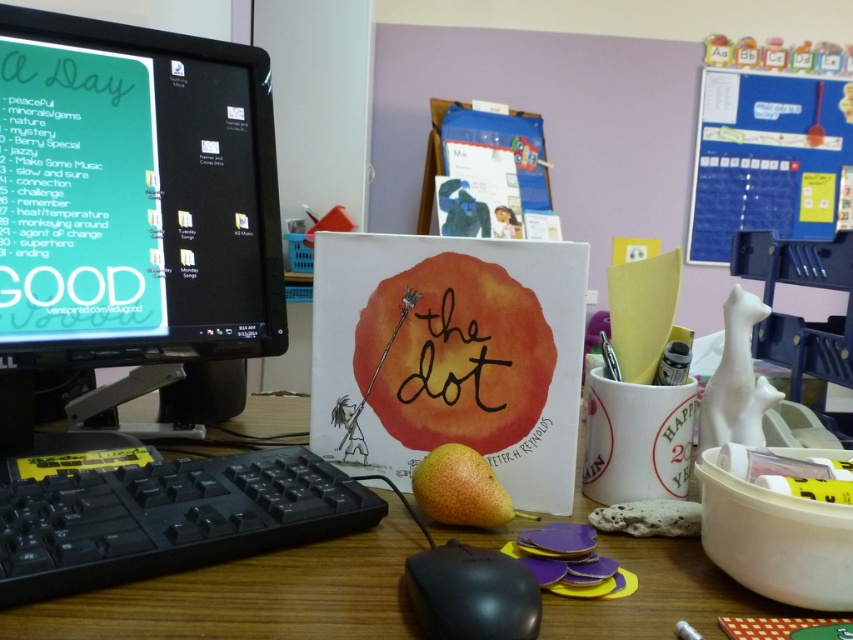
Question: Does wooden table at center appear over blue fabric calendar at upper right?

Choices:
 (A) no
 (B) yes

Answer: (A)

Question: Is blue fabric calendar at upper right thinner than yellow matte pear at center?

Choices:
 (A) no
 (B) yes

Answer: (A)

Question: Among these objects, which one is nearest to the camera?

Choices:
 (A) wooden table at center
 (B) black plastic keyboard at lower left

Answer: (A)

Question: Can you confirm if black plastic keyboard at lower left is bigger than blue fabric calendar at upper right?

Choices:
 (A) no
 (B) yes

Answer: (A)

Question: Which of these objects is positioned farthest from the black plastic mouse at center?

Choices:
 (A) wooden table at center
 (B) blue fabric calendar at upper right

Answer: (B)

Question: Estimate the real-world distances between objects in this image. Which object is farther from the wooden table at center?

Choices:
 (A) yellow matte pear at center
 (B) black plastic keyboard at lower left
 (C) blue fabric calendar at upper right
 (D) matte black monitor at left

Answer: (C)